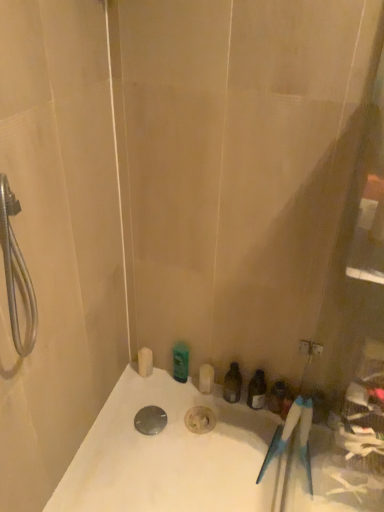
Describe the element at coordinates (277, 397) in the screenshot. I see `matte plastic toiletries at lower right, the fourth toiletry positioned from the left` at that location.

Measure the distance between translucent plastic bottle at center, acting as the 3th toiletry starting from the left, and camera.

translucent plastic bottle at center, acting as the 3th toiletry starting from the left, is 5.33 feet away from camera.

The image size is (384, 512). What do you see at coordinates (150, 420) in the screenshot?
I see `polished metallic drain at center` at bounding box center [150, 420].

I want to click on white glossy bathtub at lower center, so click(x=169, y=455).

The height and width of the screenshot is (512, 384). Describe the element at coordinates (180, 361) in the screenshot. I see `green matte bottle at upper center, arranged as the 3th toiletry when viewed from the right` at that location.

I want to click on matte plastic toiletries at lower right, which appears as the first toiletry when viewed from the right, so click(x=277, y=397).

Locate an element on the screen. Image resolution: width=384 pixels, height=512 pixels. toiletry below the translucent plastic bottle at center, which is the second toiletry in right-to-left order (from the image's perspective) is located at coordinates (277, 397).

Consider the image. Between translucent plastic bottle at center, which is the second toiletry in right-to-left order, and matte plastic toiletries at lower right, which appears as the first toiletry when viewed from the right, which one has smaller size?

matte plastic toiletries at lower right, which appears as the first toiletry when viewed from the right.

Based on the photo, from a real-world perspective, is translucent plastic bottle at center, acting as the 3th toiletry starting from the left, located beneath matte plastic toiletries at lower right, which appears as the first toiletry when viewed from the right?

No, from a real-world perspective, translucent plastic bottle at center, acting as the 3th toiletry starting from the left, is not below matte plastic toiletries at lower right, which appears as the first toiletry when viewed from the right.

Which is closer to the camera, (234, 385) or (279, 403)?

Point (234, 385) is farther from the camera than point (279, 403).

From the image's perspective, between green matte bottle at upper center, arranged as the 3th toiletry when viewed from the right, and matte plastic toiletries at lower right, which appears as the first toiletry when viewed from the right, who is located below?

matte plastic toiletries at lower right, which appears as the first toiletry when viewed from the right, appears lower in the image.

Is green matte bottle at upper center, the second toiletry in the left-to-right sequence, oriented towards matte plastic toiletries at lower right, which appears as the first toiletry when viewed from the right?

No.

Is green matte bottle at upper center, arranged as the 3th toiletry when viewed from the right, shorter than matte plastic toiletries at lower right, which appears as the first toiletry when viewed from the right?

No, green matte bottle at upper center, arranged as the 3th toiletry when viewed from the right, is not shorter than matte plastic toiletries at lower right, which appears as the first toiletry when viewed from the right.

You are a GUI agent. You are given a task and a screenshot of the screen. Output one action in this format:
    pyautogui.click(x=<x>, y=<y>)
    Task: Click on the 2nd toiletry behind the matte plastic toiletries at lower right, the fourth toiletry positioned from the left
    
    Given the screenshot: What is the action you would take?
    pyautogui.click(x=180, y=361)

What's the angular difference between polished metallic drain at center and green matte bottle at upper center, arranged as the 3th toiletry when viewed from the right,'s facing directions?

There is a 0.00285-degree angle between the facing directions of polished metallic drain at center and green matte bottle at upper center, arranged as the 3th toiletry when viewed from the right.

Between polished metallic drain at center and green matte bottle at upper center, the second toiletry in the left-to-right sequence, which one has larger size?

green matte bottle at upper center, the second toiletry in the left-to-right sequence.

Is polished metallic drain at center not within green matte bottle at upper center, the second toiletry in the left-to-right sequence?

Indeed, polished metallic drain at center is completely outside green matte bottle at upper center, the second toiletry in the left-to-right sequence.

Considering the relative positions of polished metallic drain at center and green matte bottle at upper center, arranged as the 3th toiletry when viewed from the right, in the image provided, is polished metallic drain at center to the left of green matte bottle at upper center, arranged as the 3th toiletry when viewed from the right, from the viewer's perspective?

Correct, you'll find polished metallic drain at center to the left of green matte bottle at upper center, arranged as the 3th toiletry when viewed from the right.

Consider the image. How far apart are matte plastic toiletries at lower right, the fourth toiletry positioned from the left, and translucent plastic bottle at center, acting as the 3th toiletry starting from the left?

They are 14.41 centimeters apart.

Is matte plastic toiletries at lower right, the fourth toiletry positioned from the left, oriented towards translucent plastic bottle at center, which is the second toiletry in right-to-left order?

No, matte plastic toiletries at lower right, the fourth toiletry positioned from the left, is not facing towards translucent plastic bottle at center, which is the second toiletry in right-to-left order.

From a real-world perspective, between matte plastic toiletries at lower right, the fourth toiletry positioned from the left, and translucent plastic bottle at center, acting as the 3th toiletry starting from the left, who is vertically higher?

From a 3D spatial view, translucent plastic bottle at center, acting as the 3th toiletry starting from the left, is above.

Between white matte soap dispenser at lower left, the 1th toiletry from the left, and matte plastic toiletries at lower right, which appears as the first toiletry when viewed from the right, which one has smaller size?

Smaller between the two is white matte soap dispenser at lower left, the 1th toiletry from the left.

Considering the sizes of objects white matte soap dispenser at lower left, the 1th toiletry from the left, and matte plastic toiletries at lower right, the fourth toiletry positioned from the left, in the image provided, who is thinner, white matte soap dispenser at lower left, the 1th toiletry from the left, or matte plastic toiletries at lower right, the fourth toiletry positioned from the left,?

Answer: Thinner between the two is white matte soap dispenser at lower left, the 1th toiletry from the left.

Is point (140, 353) farther from viewer compared to point (269, 396)?

Yes, point (140, 353) is behind point (269, 396).

Is polished metallic drain at center in front of or behind white matte soap dispenser at lower left, arranged as the 4th toiletry when viewed from the right, in the image?

polished metallic drain at center is in front of white matte soap dispenser at lower left, arranged as the 4th toiletry when viewed from the right.

Based on the photo, is polished metallic drain at center located outside white matte soap dispenser at lower left, arranged as the 4th toiletry when viewed from the right?

Yes, polished metallic drain at center is not within white matte soap dispenser at lower left, arranged as the 4th toiletry when viewed from the right.

Does polished metallic drain at center turn towards white matte soap dispenser at lower left, the 1th toiletry from the left?

No, polished metallic drain at center does not turn towards white matte soap dispenser at lower left, the 1th toiletry from the left.

Does white matte soap dispenser at lower left, the 1th toiletry from the left, come behind translucent plastic bottle at center, acting as the 3th toiletry starting from the left?

Yes, white matte soap dispenser at lower left, the 1th toiletry from the left, is behind translucent plastic bottle at center, acting as the 3th toiletry starting from the left.

Is white matte soap dispenser at lower left, the 1th toiletry from the left, with translucent plastic bottle at center, acting as the 3th toiletry starting from the left?

No.

Is white matte soap dispenser at lower left, the 1th toiletry from the left, smaller than translucent plastic bottle at center, acting as the 3th toiletry starting from the left?

Correct, white matte soap dispenser at lower left, the 1th toiletry from the left, occupies less space than translucent plastic bottle at center, acting as the 3th toiletry starting from the left.

Is white matte soap dispenser at lower left, arranged as the 4th toiletry when viewed from the right, outside of translucent plastic bottle at center, acting as the 3th toiletry starting from the left?

Yes, white matte soap dispenser at lower left, arranged as the 4th toiletry when viewed from the right, is outside of translucent plastic bottle at center, acting as the 3th toiletry starting from the left.

You are a GUI agent. You are given a task and a screenshot of the screen. Output one action in this format:
    pyautogui.click(x=<x>, y=<y>)
    Task: Click on the 1st toiletry counting from the left side of the matte plastic toiletries at lower right, which appears as the first toiletry when viewed from the right
    The image size is (384, 512).
    Given the screenshot: What is the action you would take?
    pyautogui.click(x=232, y=383)

This screenshot has height=512, width=384. What are the coordinates of `the 3rd toiletry located above the matte plastic toiletries at lower right, which appears as the first toiletry when viewed from the right (from a real-world perspective)` in the screenshot? It's located at (180, 361).

Which object lies nearer to the anchor point white glossy bathtub at lower center, polished metallic drain at center or translucent plastic bottle at center, which is the second toiletry in right-to-left order?

polished metallic drain at center is closer to white glossy bathtub at lower center.

Estimate the real-world distances between objects in this image. Which object is further from translucent plastic bottle at center, acting as the 3th toiletry starting from the left, polished metallic drain at center or matte plastic toiletries at lower right, which appears as the first toiletry when viewed from the right?

Based on the image, polished metallic drain at center appears to be further to translucent plastic bottle at center, acting as the 3th toiletry starting from the left.

From the image, which object appears to be farther from white matte soap dispenser at lower left, the 1th toiletry from the left, polished metallic drain at center or green matte bottle at upper center, arranged as the 3th toiletry when viewed from the right?

polished metallic drain at center.

When comparing their distances from translucent plastic bottle at center, which is the second toiletry in right-to-left order, does white glossy bathtub at lower center or green matte bottle at upper center, the second toiletry in the left-to-right sequence, seem further?

white glossy bathtub at lower center lies further to translucent plastic bottle at center, which is the second toiletry in right-to-left order, than the other object.

From the image, which object appears to be nearer to white matte soap dispenser at lower left, arranged as the 4th toiletry when viewed from the right, green matte bottle at upper center, arranged as the 3th toiletry when viewed from the right, or polished metallic drain at center?

green matte bottle at upper center, arranged as the 3th toiletry when viewed from the right, is positioned closer to the anchor white matte soap dispenser at lower left, arranged as the 4th toiletry when viewed from the right.

Considering their positions, is translucent plastic bottle at center, acting as the 3th toiletry starting from the left, positioned closer to white glossy bathtub at lower center than green matte bottle at upper center, arranged as the 3th toiletry when viewed from the right?

translucent plastic bottle at center, acting as the 3th toiletry starting from the left, is positioned closer to the anchor white glossy bathtub at lower center.

From the image, which object appears to be nearer to green matte bottle at upper center, arranged as the 3th toiletry when viewed from the right, polished metallic drain at center or matte plastic toiletries at lower right, which appears as the first toiletry when viewed from the right?

polished metallic drain at center is positioned closer to the anchor green matte bottle at upper center, arranged as the 3th toiletry when viewed from the right.

Looking at the image, which one is located closer to white glossy bathtub at lower center, matte plastic toiletries at lower right, the fourth toiletry positioned from the left, or polished metallic drain at center?

polished metallic drain at center lies closer to white glossy bathtub at lower center than the other object.

Identify the location of drain located between white matte soap dispenser at lower left, arranged as the 4th toiletry when viewed from the right, and matte plastic toiletries at lower right, the fourth toiletry positioned from the left, in the left-right direction. Image resolution: width=384 pixels, height=512 pixels. (150, 420).

Image resolution: width=384 pixels, height=512 pixels. Find the location of `toiletry situated between green matte bottle at upper center, arranged as the 3th toiletry when viewed from the right, and matte plastic toiletries at lower right, which appears as the first toiletry when viewed from the right, from left to right`. toiletry situated between green matte bottle at upper center, arranged as the 3th toiletry when viewed from the right, and matte plastic toiletries at lower right, which appears as the first toiletry when viewed from the right, from left to right is located at coordinates (232, 383).

Identify the location of drain located between white matte soap dispenser at lower left, arranged as the 4th toiletry when viewed from the right, and translucent plastic bottle at center, which is the second toiletry in right-to-left order, in the left-right direction. This screenshot has width=384, height=512. (150, 420).

You are a GUI agent. You are given a task and a screenshot of the screen. Output one action in this format:
    pyautogui.click(x=<x>, y=<y>)
    Task: Click on the drain between white glossy bathtub at lower center and green matte bottle at upper center, arranged as the 3th toiletry when viewed from the right, from front to back
    
    Given the screenshot: What is the action you would take?
    pyautogui.click(x=150, y=420)